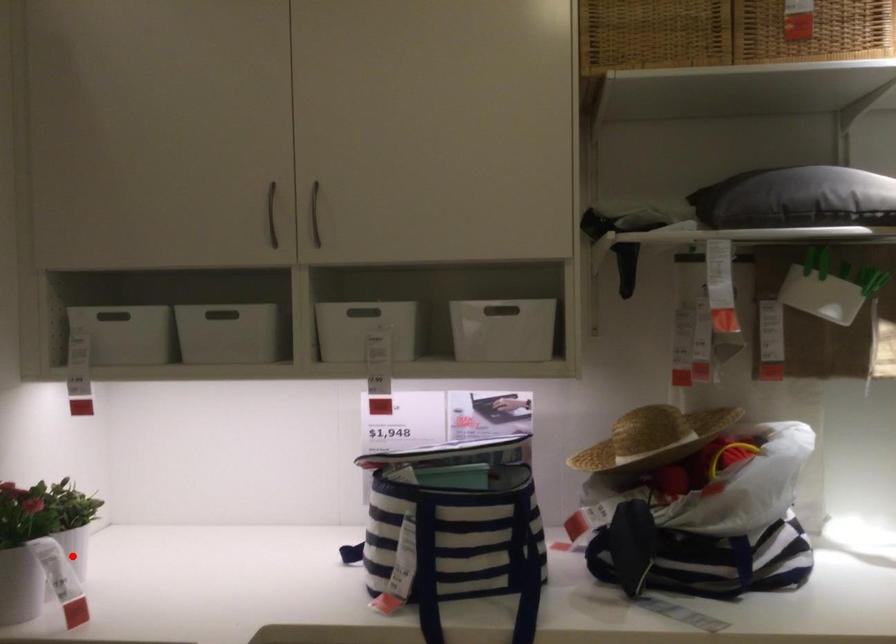
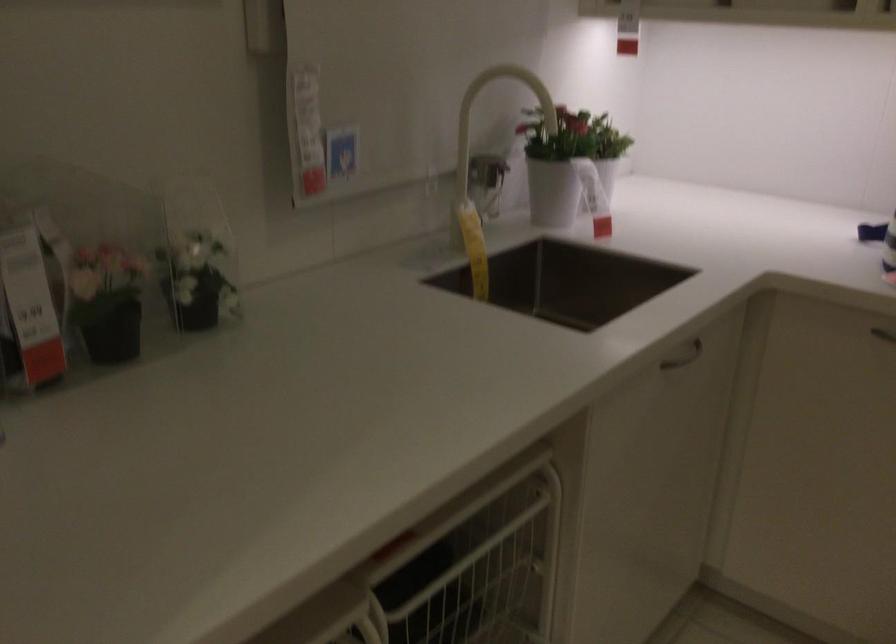
Locate, in the second image, the point that corresponds to the highlighted location in the first image.

(604, 180)